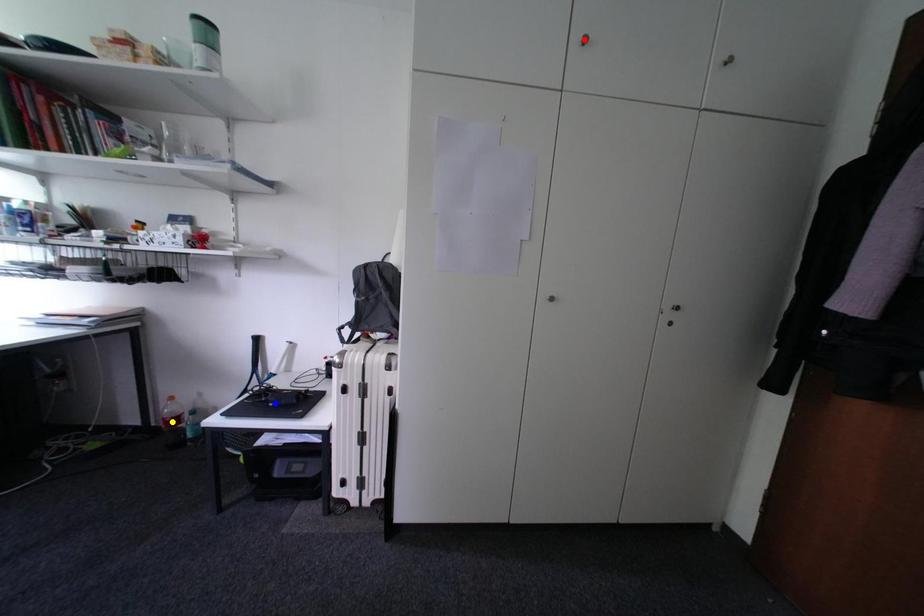
Order these from nearest to farthest:
red point
blue point
yellow point

1. red point
2. blue point
3. yellow point